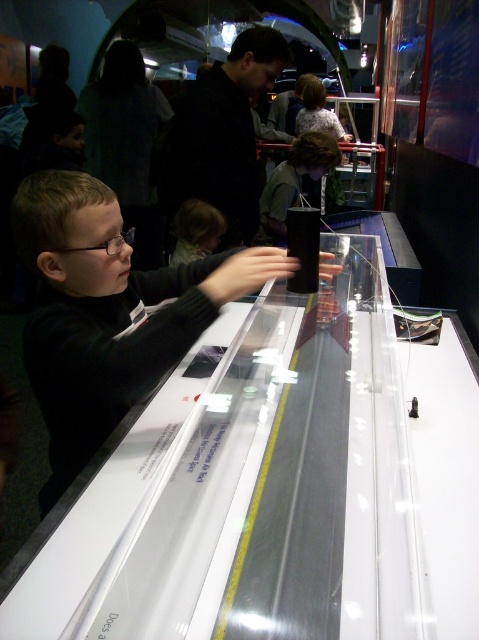
You are an artist trying to sketch this scene. You notice the matte black shirt at center and the smooth brown hair at center. Which of these two elements should you draw first if you want to follow the principle of drawing larger objects before smaller ones?

The matte black shirt at center should be drawn first because it is larger than the smooth brown hair at center.

You are standing in the museum and see two points marked on the display case. The first point is at coordinate point (81, 454) and the second is at point (175, 218). Which point is closer to you?

Point (81, 454) is in front of point (175, 218), so it is closer to you.